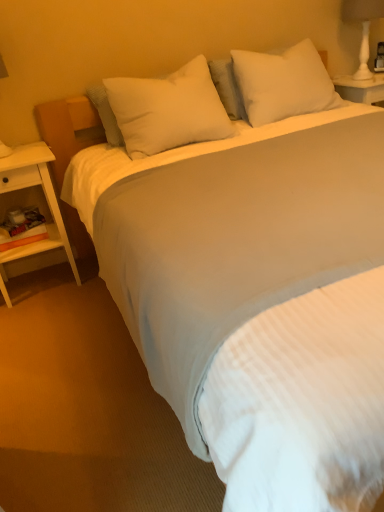
The image size is (384, 512). What do you see at coordinates (46, 200) in the screenshot?
I see `white wood nightstand at left` at bounding box center [46, 200].

What is the approximate width of white wood nightstand at left?

The width of white wood nightstand at left is 14.84 inches.

In order to face white soft pillow at upper center, the second pillow in the right-to-left sequence, should I rotate leftwards or rightwards?

You should rotate left by 2.648 degrees.

Identify the location of white ceramic lamp at upper right. The height and width of the screenshot is (512, 384). (363, 28).

Which object is positioned more to the left, white soft pillow at upper center, which ranks as the 2th pillow in left-to-right order, or white soft pillow at upper center, the second pillow in the right-to-left sequence?

From the viewer's perspective, white soft pillow at upper center, the second pillow in the right-to-left sequence, appears more on the left side.

Consider the image. Who is taller, white soft pillow at upper center, which ranks as the 2th pillow in left-to-right order, or white soft pillow at upper center, which is the 1th pillow in left-to-right order?

Standing taller between the two is white soft pillow at upper center, which ranks as the 2th pillow in left-to-right order.

Is white soft pillow at upper center, which ranks as the 2th pillow in left-to-right order, oriented towards white soft pillow at upper center, the second pillow in the right-to-left sequence?

No, white soft pillow at upper center, which ranks as the 2th pillow in left-to-right order, is not facing towards white soft pillow at upper center, the second pillow in the right-to-left sequence.

From a real-world perspective, is white soft pillow at upper center, which ranks as the 2th pillow in left-to-right order, physically located above or below white soft pillow at upper center, the second pillow in the right-to-left sequence?

In terms of real-world spatial position, white soft pillow at upper center, which ranks as the 2th pillow in left-to-right order, is below white soft pillow at upper center, the second pillow in the right-to-left sequence.

Between point (51, 246) and point (199, 76), which one is positioned in front?

Positioned in front is point (199, 76).

Is white wood nightstand at left oriented towards white soft pillow at upper center, the second pillow in the right-to-left sequence?

No, white wood nightstand at left is not facing towards white soft pillow at upper center, the second pillow in the right-to-left sequence.

In the scene shown: Is white wood nightstand at left taller or shorter than white soft pillow at upper center, which is the 1th pillow in left-to-right order?

In the image, white wood nightstand at left appears to be taller than white soft pillow at upper center, which is the 1th pillow in left-to-right order.

Between white soft pillow at upper center, the second pillow in the right-to-left sequence, and white ceramic lamp at upper right, which one has more height?

white ceramic lamp at upper right.

From a real-world perspective, is white soft pillow at upper center, which is the 1th pillow in left-to-right order, above or below white ceramic lamp at upper right?

white soft pillow at upper center, which is the 1th pillow in left-to-right order, is situated lower than white ceramic lamp at upper right in the real world.

Where is `bedside lamp lying on the right of white soft pillow at upper center, which is the 1th pillow in left-to-right order`? The image size is (384, 512). bedside lamp lying on the right of white soft pillow at upper center, which is the 1th pillow in left-to-right order is located at coordinates (363, 28).

Which of these two, white soft pillow at upper center, which is the 1th pillow in left-to-right order, or white ceramic lamp at upper right, is wider?

Wider between the two is white soft pillow at upper center, which is the 1th pillow in left-to-right order.

From a real-world perspective, which object rests below the other?

In real-world perspective, white wood nightstand at left is lower.

Is white ceramic lamp at upper right touching white wood nightstand at left?

They are not placed beside each other.

Who is smaller, white ceramic lamp at upper right or white wood nightstand at left?

Smaller between the two is white ceramic lamp at upper right.

Can you confirm if white ceramic lamp at upper right is taller than white wood nightstand at left?

No, white ceramic lamp at upper right is not taller than white wood nightstand at left.

Considering the relative positions of white soft pillow at upper center, the second pillow in the right-to-left sequence, and white soft pillow at upper center, which ranks as the 2th pillow in left-to-right order, in the image provided, is white soft pillow at upper center, the second pillow in the right-to-left sequence, to the left or to the right of white soft pillow at upper center, which ranks as the 2th pillow in left-to-right order,?

Based on their positions, white soft pillow at upper center, the second pillow in the right-to-left sequence, is located to the left of white soft pillow at upper center, which ranks as the 2th pillow in left-to-right order.

At what (x,y) coordinates should I click in order to perform the action: click on pillow on the left of white soft pillow at upper center, which ranks as the 2th pillow in left-to-right order. Please return your answer as a coordinate pair (x, y). Looking at the image, I should click on (168, 110).

From the picture: Considering the relative sizes of white soft pillow at upper center, the second pillow in the right-to-left sequence, and white soft pillow at upper center, which ranks as the 2th pillow in left-to-right order, in the image provided, is white soft pillow at upper center, the second pillow in the right-to-left sequence, wider than white soft pillow at upper center, which ranks as the 2th pillow in left-to-right order,?

Indeed, white soft pillow at upper center, the second pillow in the right-to-left sequence, has a greater width compared to white soft pillow at upper center, which ranks as the 2th pillow in left-to-right order.

Is white soft pillow at upper center, the second pillow in the right-to-left sequence, oriented away from white soft pillow at upper center, acting as the first pillow starting from the right?

No, white soft pillow at upper center, the second pillow in the right-to-left sequence, is not facing the opposite direction of white soft pillow at upper center, acting as the first pillow starting from the right.

Is white soft pillow at upper center, acting as the first pillow starting from the right, oriented towards white ceramic lamp at upper right?

No, white soft pillow at upper center, acting as the first pillow starting from the right, is not aimed at white ceramic lamp at upper right.

What's the angular difference between white soft pillow at upper center, acting as the first pillow starting from the right, and white ceramic lamp at upper right's facing directions?

1.29 degrees.

Considering their positions, is white soft pillow at upper center, which ranks as the 2th pillow in left-to-right order, located in front of or behind white ceramic lamp at upper right?

Visually, white soft pillow at upper center, which ranks as the 2th pillow in left-to-right order, is located in front of white ceramic lamp at upper right.

Is white ceramic lamp at upper right to the left of white soft pillow at upper center, acting as the first pillow starting from the right, from the viewer's perspective?

Incorrect, white ceramic lamp at upper right is not on the left side of white soft pillow at upper center, acting as the first pillow starting from the right.

Is white ceramic lamp at upper right not near white soft pillow at upper center, acting as the first pillow starting from the right?

No, there isn't a large distance between white ceramic lamp at upper right and white soft pillow at upper center, acting as the first pillow starting from the right.

Which object is closer to the camera taking this photo, white ceramic lamp at upper right or white soft pillow at upper center, which ranks as the 2th pillow in left-to-right order?

white soft pillow at upper center, which ranks as the 2th pillow in left-to-right order, is more forward.

Looking at this image, from a real-world perspective, which object rests below the other?

From a 3D spatial view, white soft pillow at upper center, which ranks as the 2th pillow in left-to-right order, is below.

Where is `pillow that is behind the white soft pillow at upper center, the second pillow in the right-to-left sequence`? The height and width of the screenshot is (512, 384). pillow that is behind the white soft pillow at upper center, the second pillow in the right-to-left sequence is located at coordinates (283, 83).

I want to click on the 1st pillow counting from the right side of the white wood nightstand at left, so click(168, 110).

When comparing their distances from white soft pillow at upper center, which ranks as the 2th pillow in left-to-right order, does white wood nightstand at left or white soft pillow at upper center, the second pillow in the right-to-left sequence, seem closer?

white soft pillow at upper center, the second pillow in the right-to-left sequence.

Based on their spatial positions, is white ceramic lamp at upper right or white soft pillow at upper center, the second pillow in the right-to-left sequence, further from white soft pillow at upper center, acting as the first pillow starting from the right?

The object further to white soft pillow at upper center, acting as the first pillow starting from the right, is white ceramic lamp at upper right.

From the image, which object appears to be farther from white soft pillow at upper center, which ranks as the 2th pillow in left-to-right order, white soft pillow at upper center, which is the 1th pillow in left-to-right order, or white wood nightstand at left?

Among the two, white wood nightstand at left is located further to white soft pillow at upper center, which ranks as the 2th pillow in left-to-right order.

When comparing their distances from white ceramic lamp at upper right, does white wood nightstand at left or white soft pillow at upper center, acting as the first pillow starting from the right, seem further?

white wood nightstand at left lies further to white ceramic lamp at upper right than the other object.

From the image, which object appears to be nearer to white ceramic lamp at upper right, white soft pillow at upper center, the second pillow in the right-to-left sequence, or white wood nightstand at left?

The object closer to white ceramic lamp at upper right is white soft pillow at upper center, the second pillow in the right-to-left sequence.

Considering their positions, is white wood nightstand at left positioned closer to white ceramic lamp at upper right than white soft pillow at upper center, which is the 1th pillow in left-to-right order?

white soft pillow at upper center, which is the 1th pillow in left-to-right order, is positioned closer to the anchor white ceramic lamp at upper right.

Looking at the image, which one is located closer to white wood nightstand at left, white ceramic lamp at upper right or white soft pillow at upper center, the second pillow in the right-to-left sequence?

The object closer to white wood nightstand at left is white soft pillow at upper center, the second pillow in the right-to-left sequence.

Which object lies further to the anchor point white wood nightstand at left, white soft pillow at upper center, which ranks as the 2th pillow in left-to-right order, or white ceramic lamp at upper right?

white ceramic lamp at upper right is positioned further to the anchor white wood nightstand at left.

I want to click on pillow between white soft pillow at upper center, the second pillow in the right-to-left sequence, and white ceramic lamp at upper right from left to right, so click(x=283, y=83).

The height and width of the screenshot is (512, 384). Find the location of `pillow located between white wood nightstand at left and white soft pillow at upper center, which ranks as the 2th pillow in left-to-right order, in the left-right direction`. pillow located between white wood nightstand at left and white soft pillow at upper center, which ranks as the 2th pillow in left-to-right order, in the left-right direction is located at coordinates (168, 110).